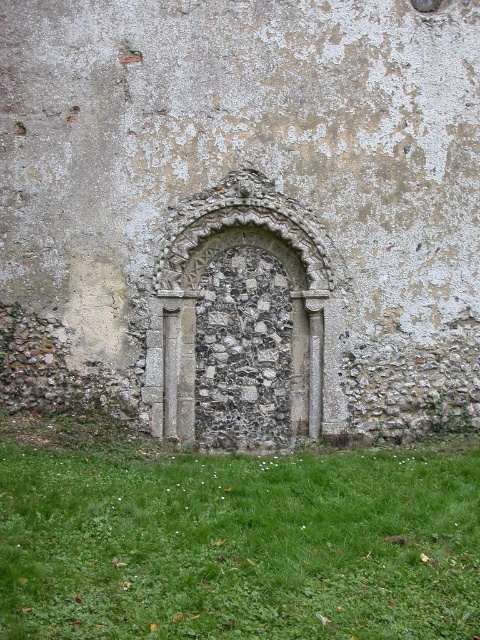
What do you see at coordinates (239, 545) in the screenshot? The width and height of the screenshot is (480, 640). I see `green grass at lower center` at bounding box center [239, 545].

Is point (243, 637) positioned before point (238, 284)?

That is True.

Describe the element at coordinates (239, 545) in the screenshot. The image size is (480, 640). I see `green grass at lower center` at that location.

You are a GUI agent. You are given a task and a screenshot of the screen. Output one action in this format:
    pyautogui.click(x=<x>, y=<y>)
    Task: Click on the green grass at lower center
    This screenshot has width=480, height=640.
    Given the screenshot: What is the action you would take?
    pyautogui.click(x=239, y=545)